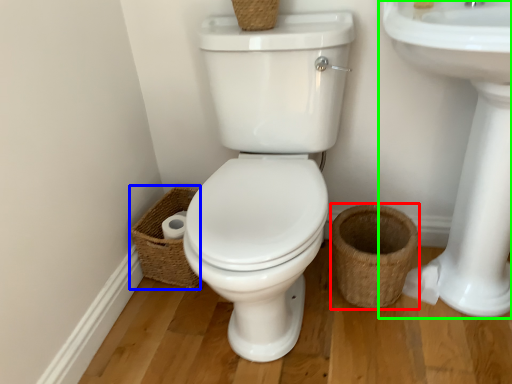
Question: Considering the real-world distances, which object is farthest from basket (highlighted by a red box)? basket (highlighted by a blue box) or sink (highlighted by a green box)?

Choices:
 (A) basket
 (B) sink

Answer: (A)